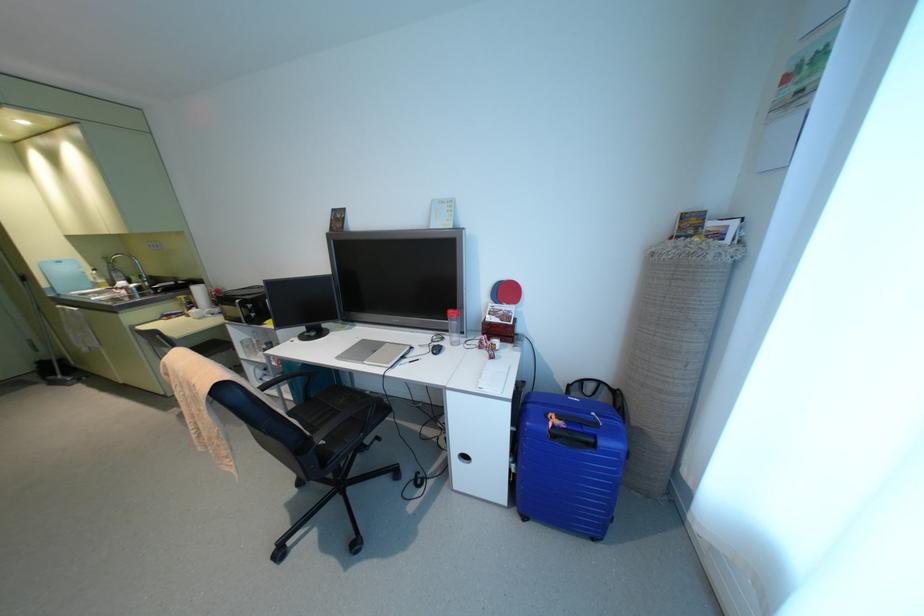
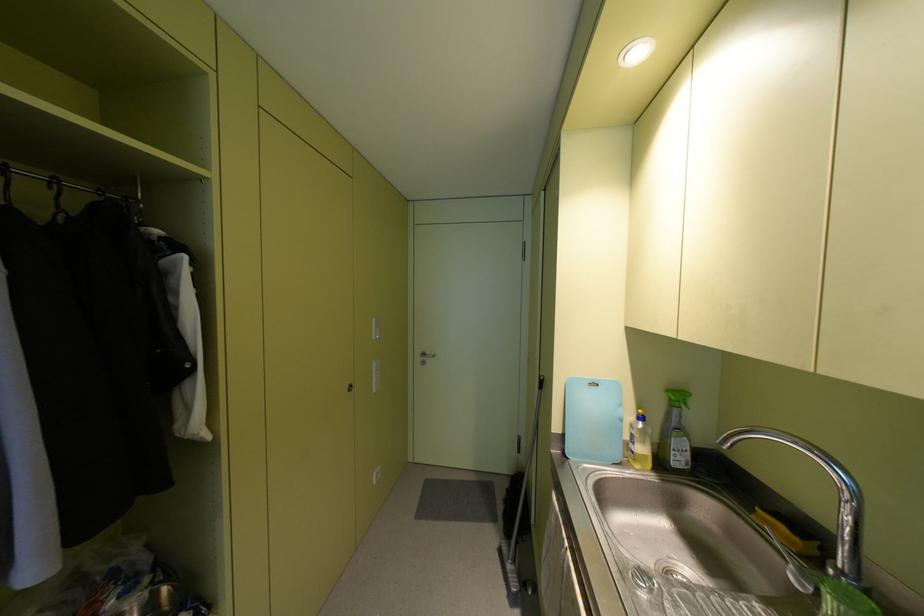
Locate, in the second image, the point that corresponds to [26,278] in the first image.

(542, 384)